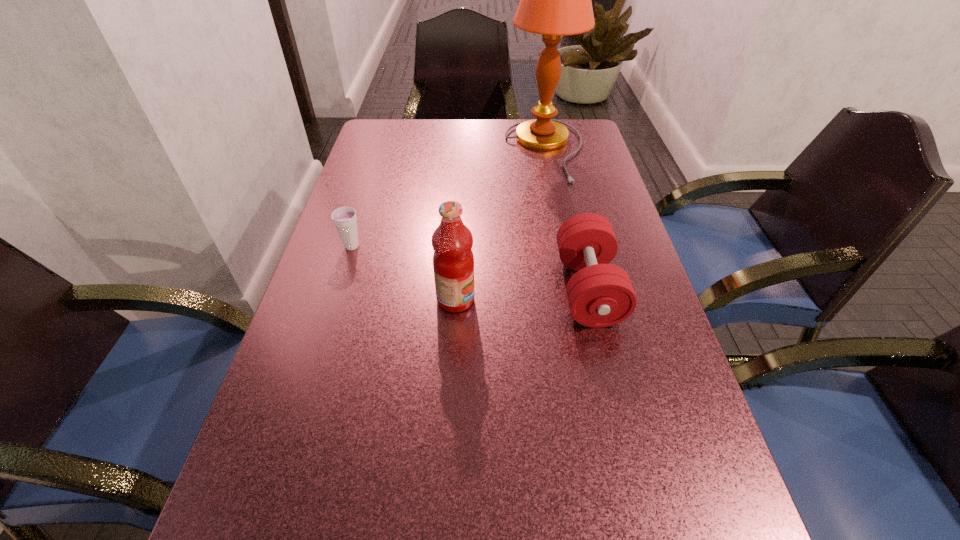
Identify the location of vacant area that lies between the leftmost object and the fruit juice. Image resolution: width=960 pixels, height=540 pixels. (404, 273).

The image size is (960, 540). What are the coordinates of `blank region between the third tallest object and the fruit juice` in the screenshot? It's located at (522, 294).

Find the location of `object that stands as the third closest to the dumbbell`. object that stands as the third closest to the dumbbell is located at coordinates (344, 218).

Select which object is the closest to the fruit juice. Please provide its 2D coordinates. Your answer should be formatted as a tuple, i.e. [(x, y)], where the tuple contains the x and y coordinates of a point satisfying the conditions above.

[(600, 294)]

This screenshot has height=540, width=960. Find the location of `free location that satisfies the following two spatial constraints: 1. on the front side of the tallest object; 2. on the front label of the fruit juice`. free location that satisfies the following two spatial constraints: 1. on the front side of the tallest object; 2. on the front label of the fruit juice is located at coordinates (576, 300).